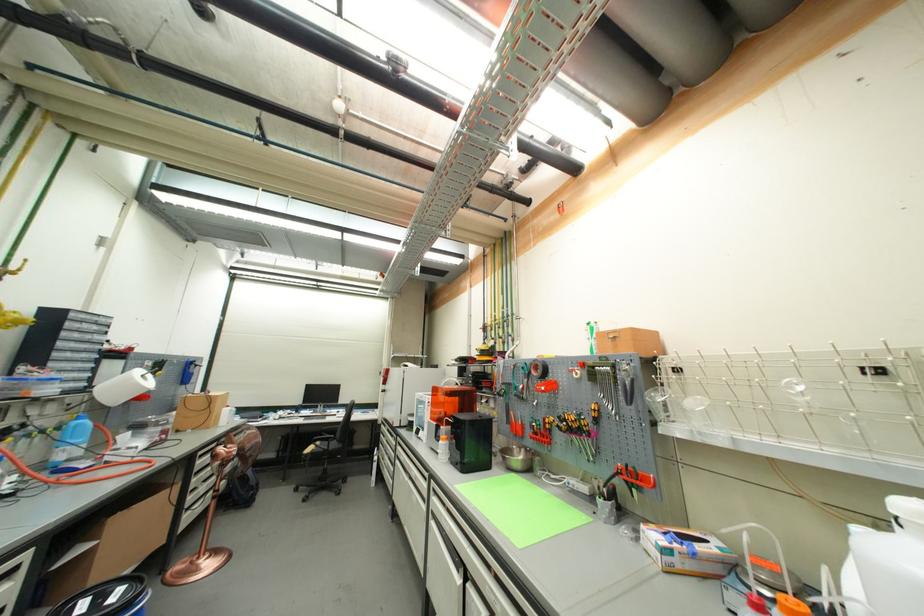
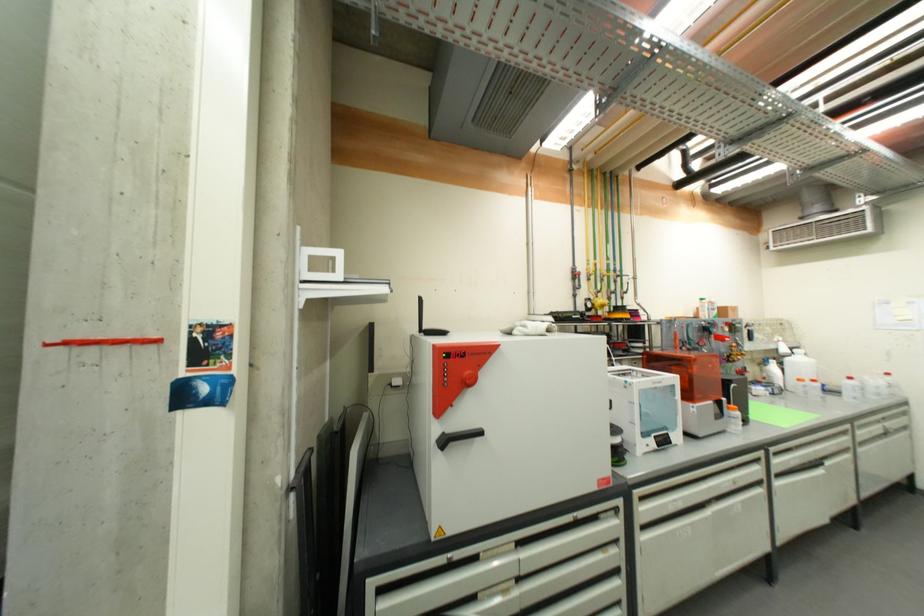
Find the pixel in the second image that matches (393,432) in the first image.

(525, 546)